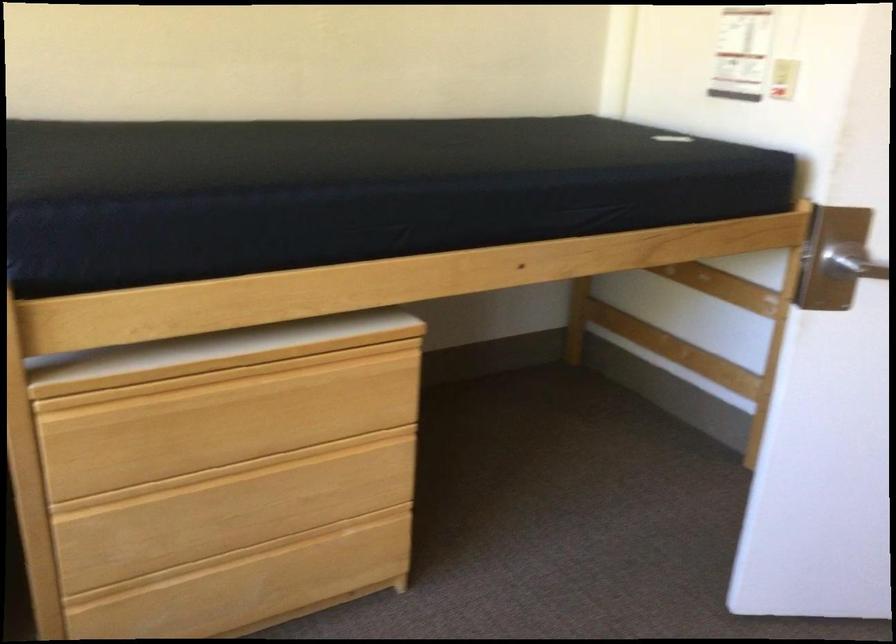
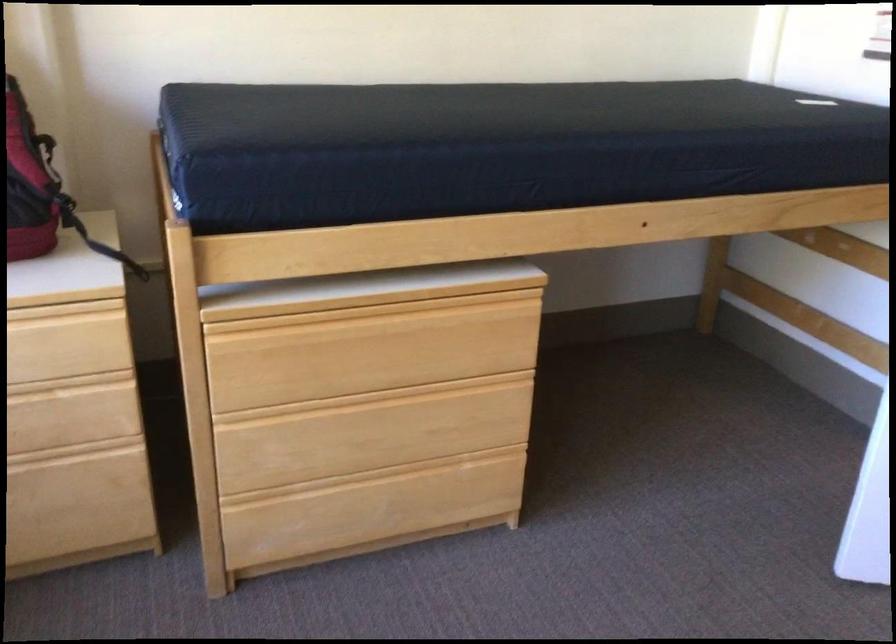
In the second image, find the point that corresponds to pixel 235 513 in the first image.

(371, 433)